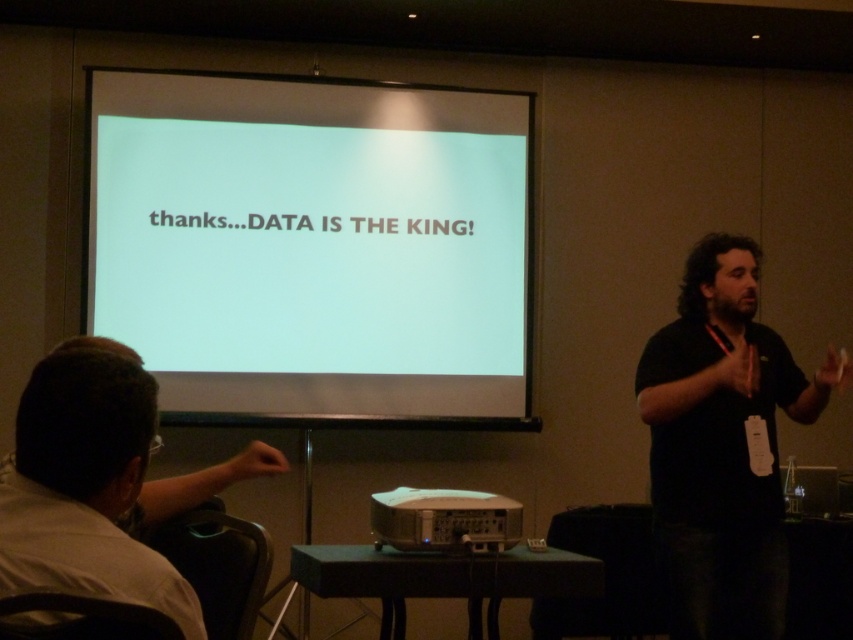
Question: Is white matte projection screen at upper center to the right of metallic projector at center from the viewer's perspective?

Choices:
 (A) no
 (B) yes

Answer: (A)

Question: Does black shirt at center appear on the right side of metallic projector at center?

Choices:
 (A) no
 (B) yes

Answer: (B)

Question: Is black shirt at center to the right of metallic projector at center from the viewer's perspective?

Choices:
 (A) yes
 (B) no

Answer: (A)

Question: Which object appears closest to the camera in this image?

Choices:
 (A) black shirt at center
 (B) metallic projector at center
 (C) white matte projection screen at upper center

Answer: (B)

Question: Among these objects, which one is nearest to the camera?

Choices:
 (A) metallic projector at center
 (B) black shirt at center

Answer: (A)

Question: Among these points, which one is nearest to the camera?

Choices:
 (A) (680, 589)
 (B) (373, 157)

Answer: (A)